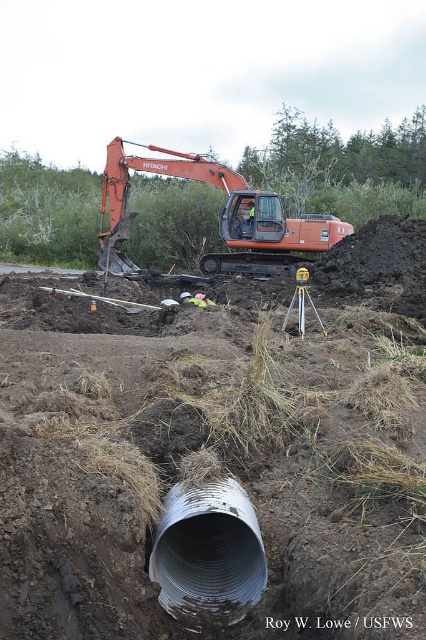
Is orange metallic excavator at center above yellow plastic tripod at center?

Yes, orange metallic excavator at center is above yellow plastic tripod at center.

Is orange metallic excavator at center in front of yellow plastic tripod at center?

No, orange metallic excavator at center is further to the viewer.

Where is `orange metallic excavator at center`? This screenshot has height=640, width=426. orange metallic excavator at center is located at coordinates (218, 216).

Find the location of `orange metallic excavator at center`. orange metallic excavator at center is located at coordinates (218, 216).

Who is shorter, orange metallic excavator at center or reflective safety vest at center?

Standing shorter between the two is reflective safety vest at center.

Is point (241, 230) positioned after point (241, 204)?

No, it is in front of (241, 204).

Identify the location of orange metallic excavator at center. The image size is (426, 640). (218, 216).

Does smooth brown dirt at center have a greater height compared to green fabric construction worker at center?

Yes.

Between smooth brown dirt at center and green fabric construction worker at center, which one has more height?

Standing taller between the two is smooth brown dirt at center.

Is point (348, 419) closer to camera compared to point (204, 296)?

That is True.

The height and width of the screenshot is (640, 426). What are the coordinates of `smooth brown dirt at center` in the screenshot? It's located at (207, 461).